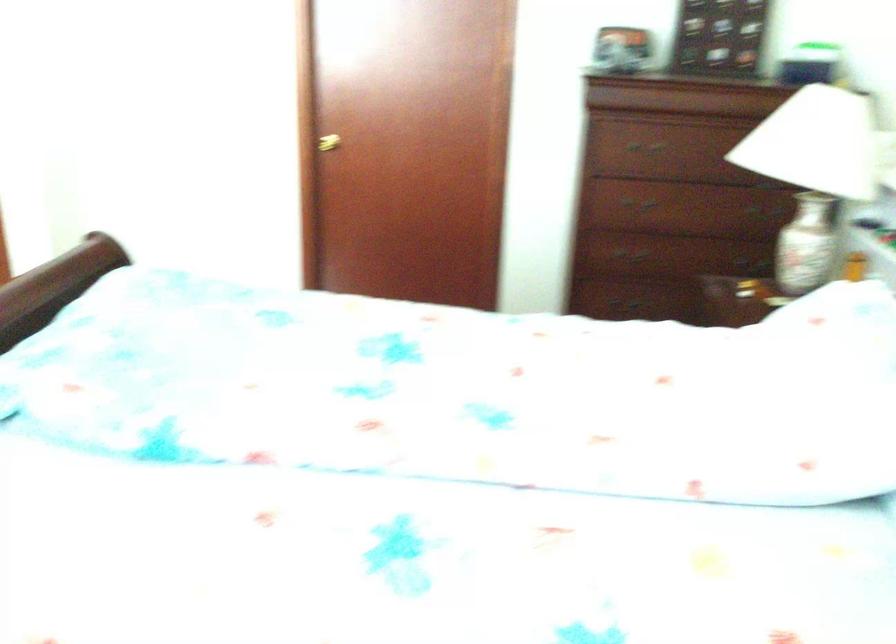
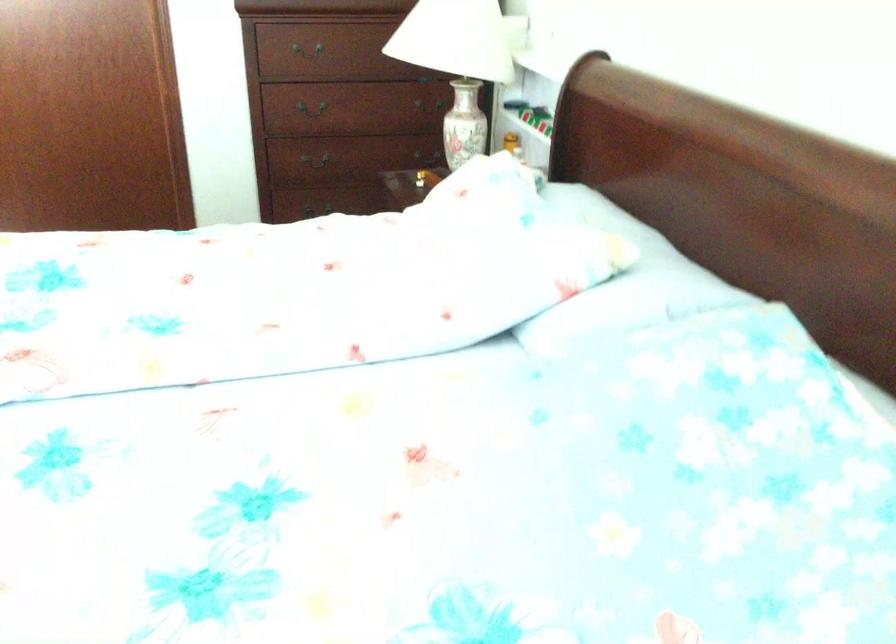
Find the pixel in the second image that matches (x=813, y=237) in the first image.

(463, 124)